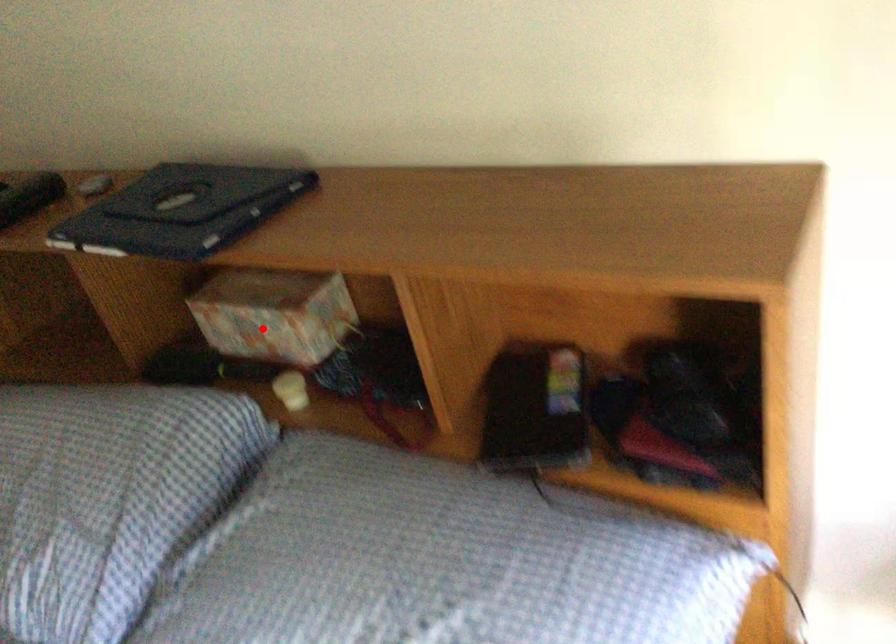
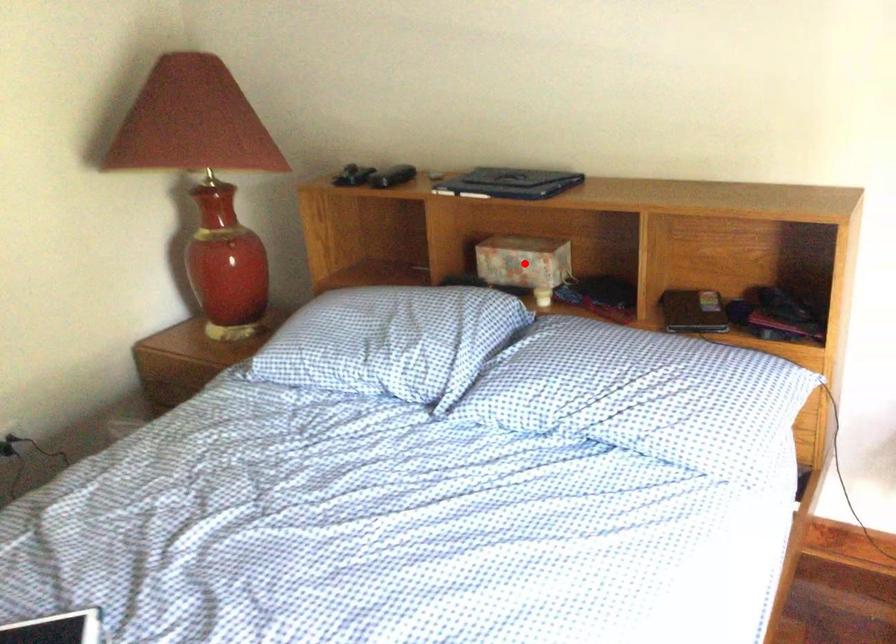
I am providing you with two images of the same scene from different viewpoints. A red point is marked on the first image and another point is marked on the second image. Do the highlighted points in image1 and image2 indicate the same real-world spot?

Yes